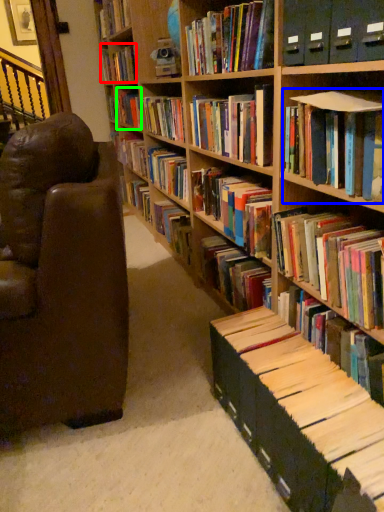
Question: Considering the real-world distances, which object is closest to book (highlighted by a red box)? book (highlighted by a blue box) or book (highlighted by a green box).

Choices:
 (A) book
 (B) book

Answer: (B)